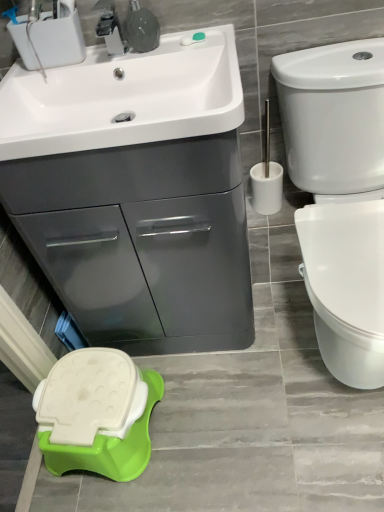
Identify the location of free space in front of green plastic stool at lower left. The image size is (384, 512). point(94,494).